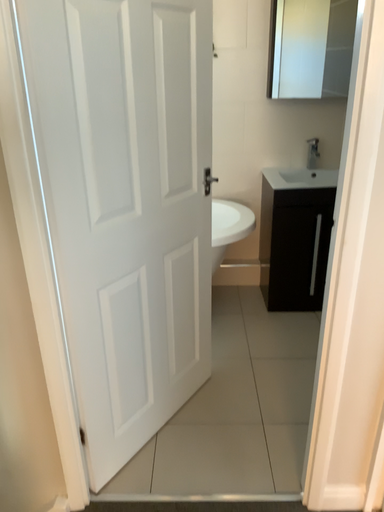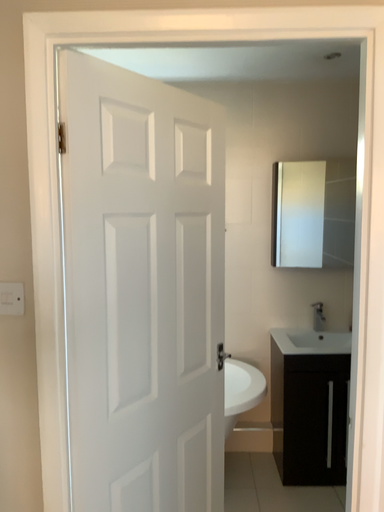
Question: Which way did the camera rotate in the video?

Choices:
 (A) rotated downward
 (B) rotated upward

Answer: (B)